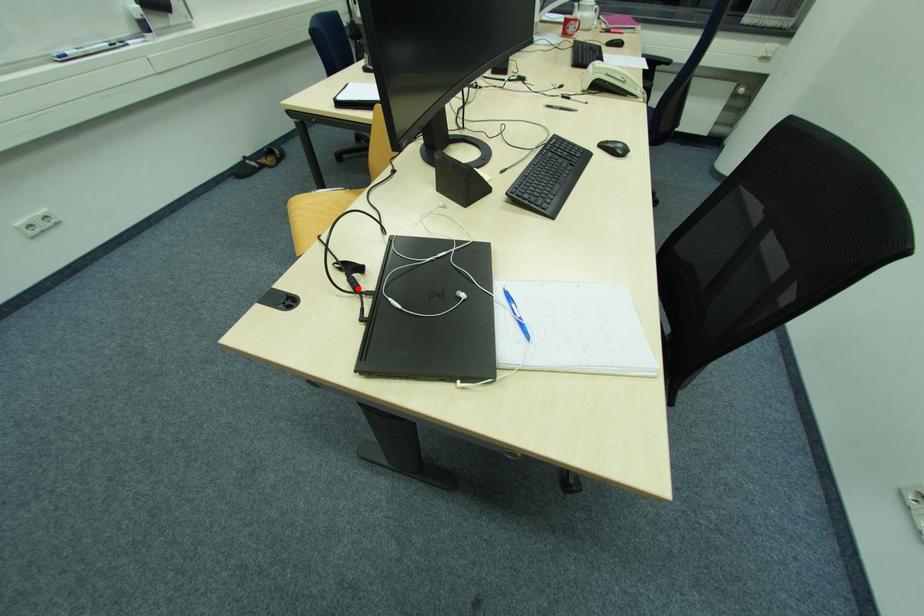
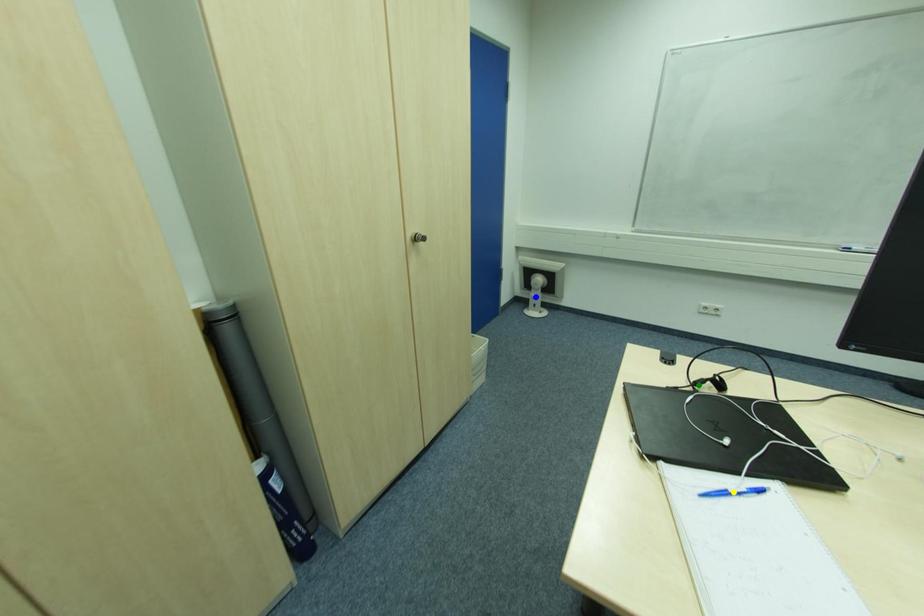
Question: I am providing you with two images of the same scene from different viewpoints. A red point is marked on the first image. You are given multiple points on the second image. Which spot in image 2 lines up with the point in image 1?

Choices:
 (A) blue point
 (B) green point
 (C) yellow point

Answer: (B)